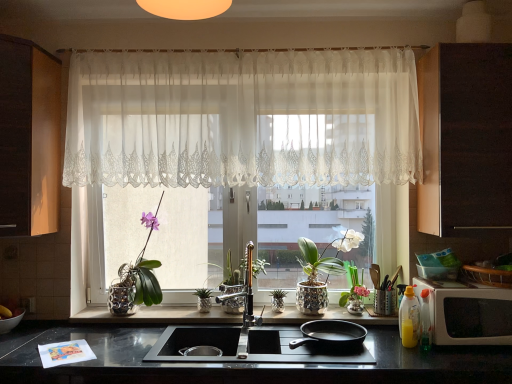
Find the location of a particular element. The height and width of the screenshot is (384, 512). vacant area that lies between black matte frying pan at center and translucent plastic bottle at lower right is located at coordinates (397, 354).